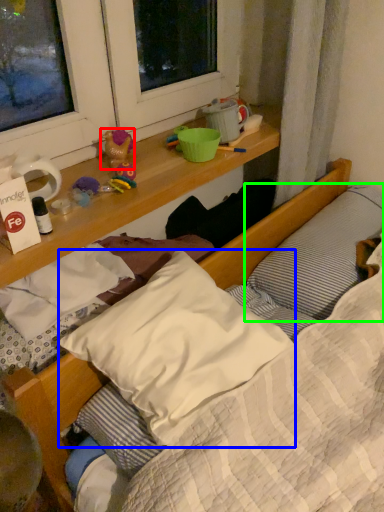
Question: Which object is positioned closest to toy (highlighted by a red box)? Select from pillow (highlighted by a blue box) and pillow (highlighted by a green box).

Choices:
 (A) pillow
 (B) pillow

Answer: (A)